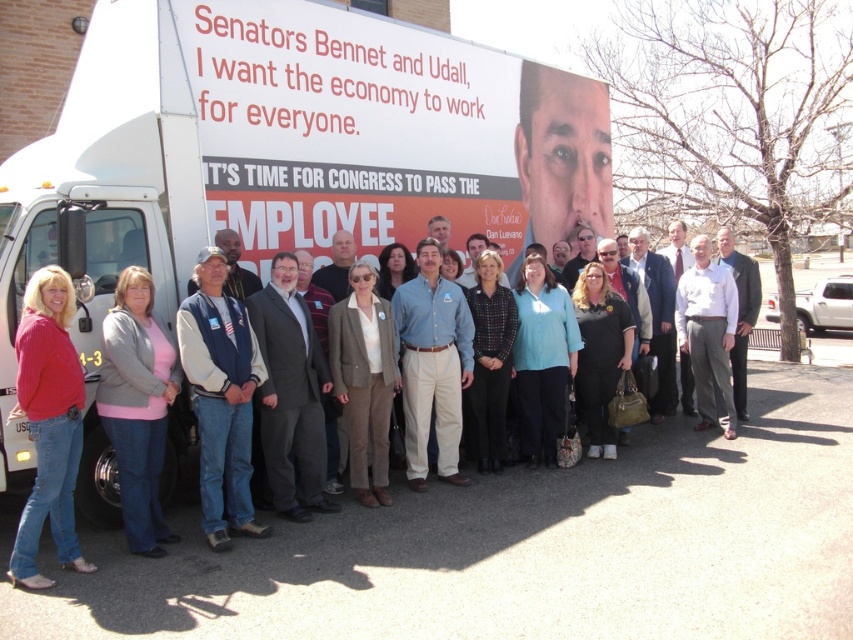
Is jeans at lower left bigger than blue fabric shirt at center?

Actually, jeans at lower left might be smaller than blue fabric shirt at center.

Consider the image. Does jeans at lower left come behind blue fabric shirt at center?

That is False.

Image resolution: width=853 pixels, height=640 pixels. What do you see at coordinates (48, 422) in the screenshot?
I see `jeans at lower left` at bounding box center [48, 422].

Where is `jeans at lower left`? jeans at lower left is located at coordinates (48, 422).

Which is more to the right, smooth skin face at center or white shirt at center?

Positioned to the right is white shirt at center.

Consider the image. Is smooth skin face at center smaller than white shirt at center?

Incorrect, smooth skin face at center is not smaller in size than white shirt at center.

Measure the distance between point (553,118) and camera.

A distance of 9.35 meters exists between point (553,118) and camera.

Locate an element on the screen. This screenshot has height=640, width=853. smooth skin face at center is located at coordinates (561, 154).

Between point (315, 65) and point (357, 310), which one is positioned behind?

Positioned behind is point (315, 65).

Does point (407, 131) come closer to viewer compared to point (341, 332)?

No.

The height and width of the screenshot is (640, 853). I want to click on white truck at center, so click(x=277, y=161).